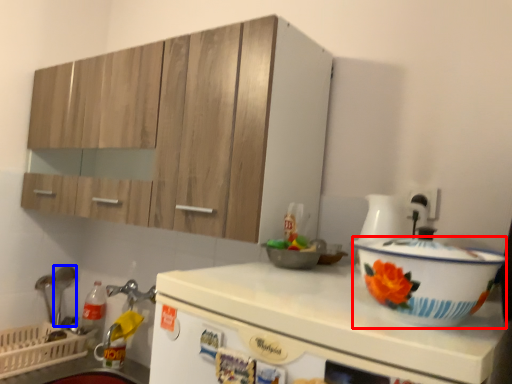
Question: Among these objects, which one is nearest to the camera, basin (highlighted by a red box) or tableware (highlighted by a blue box)?

Choices:
 (A) basin
 (B) tableware

Answer: (A)